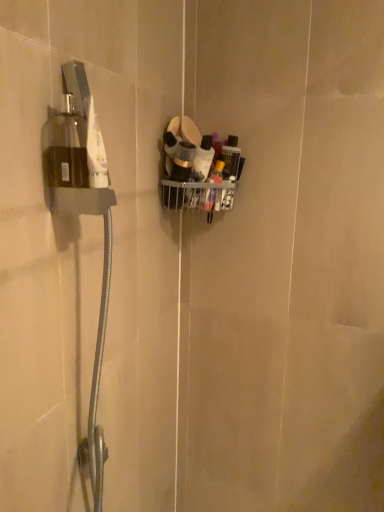
Question: In terms of size, does translucent plastic bottles at upper right, which appears as the 2th toiletry when viewed from the left, appear bigger or smaller than matte black container at center, the first toiletry when ordered from left to right?

Choices:
 (A) big
 (B) small

Answer: (B)

Question: Is translucent plastic bottles at upper right, which appears as the 2th toiletry when viewed from the left, to the left or to the right of matte black container at center, the first toiletry when ordered from left to right, in the image?

Choices:
 (A) left
 (B) right

Answer: (B)

Question: Relative to matte black container at center, marked as the 2th toiletry in a right-to-left arrangement, is translucent plastic bottles at upper right, which ranks as the 1th toiletry in right-to-left order, in front or behind?

Choices:
 (A) behind
 (B) front

Answer: (A)

Question: From their relative heights in the image, would you say matte black container at center, marked as the 2th toiletry in a right-to-left arrangement, is taller or shorter than translucent plastic bottles at upper right, which appears as the 2th toiletry when viewed from the left?

Choices:
 (A) tall
 (B) short

Answer: (A)

Question: Considering the positions of matte black container at center, the first toiletry when ordered from left to right, and translucent plastic bottles at upper right, which appears as the 2th toiletry when viewed from the left, in the image, is matte black container at center, the first toiletry when ordered from left to right, wider or thinner than translucent plastic bottles at upper right, which appears as the 2th toiletry when viewed from the left,?

Choices:
 (A) thin
 (B) wide

Answer: (B)

Question: Visually, is matte black container at center, the first toiletry when ordered from left to right, positioned to the left or to the right of translucent plastic bottles at upper right, which ranks as the 1th toiletry in right-to-left order?

Choices:
 (A) right
 (B) left

Answer: (B)

Question: Would you say matte black container at center, the first toiletry when ordered from left to right, is inside or outside translucent plastic bottles at upper right, which ranks as the 1th toiletry in right-to-left order?

Choices:
 (A) inside
 (B) outside

Answer: (B)